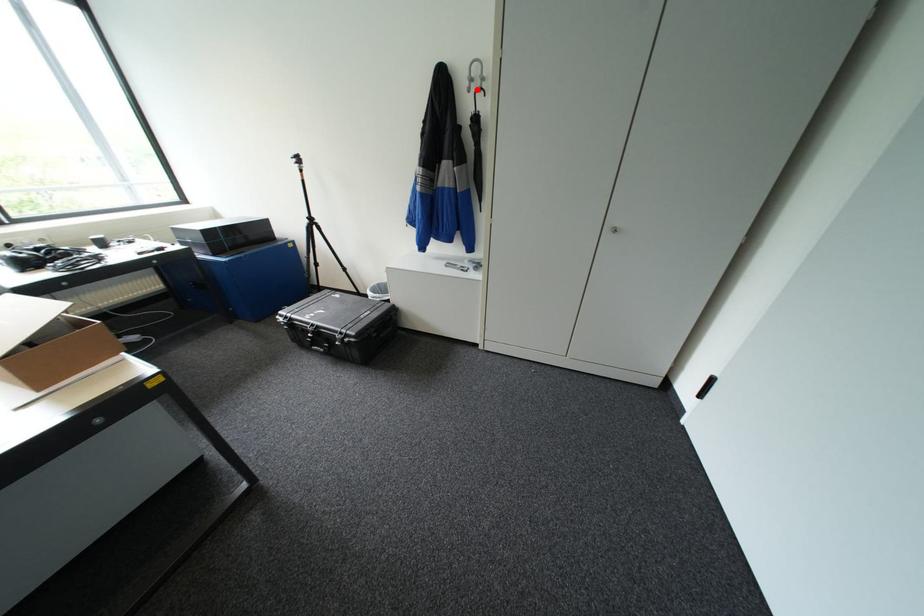
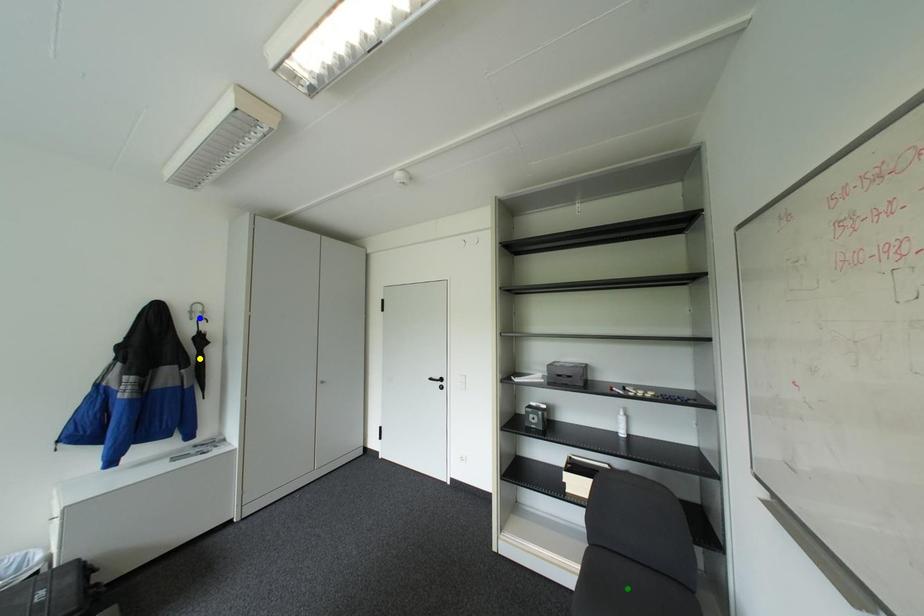
Question: I am providing you with two images of the same scene from different viewpoints. A red point is marked on the first image. You are given multiple points on the second image. Which mark in image 2 goes with the point in image 1?

Choices:
 (A) green point
 (B) blue point
 (C) yellow point

Answer: (B)